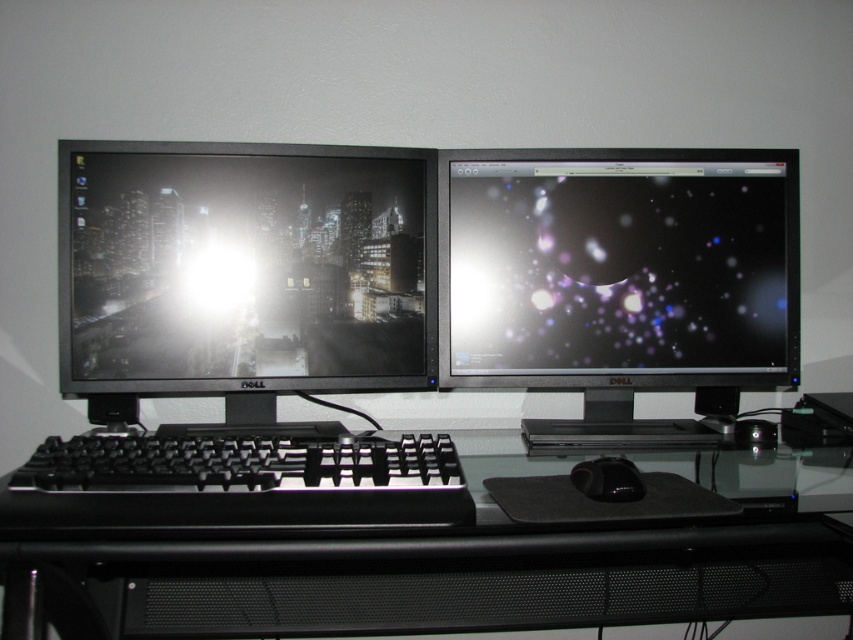
You are a photographer trying to capture the reflections on the left monitor. You notice two points of light on the desk setup. One is at point [715,372] and the other at point [633,480]. Which point is closer to your camera lens?

Point [633,480] is closer to the camera lens because it is less further away than point [715,372].

You are sitting at the desk in front of the dual monitors. You need to reach for the black plastic keyboard at center without touching the matte black monitor at right. Is this possible given their positions?

The matte black monitor at right is to the right of the black plastic keyboard at center, so there is space between them. You can reach the keyboard without touching the monitor.